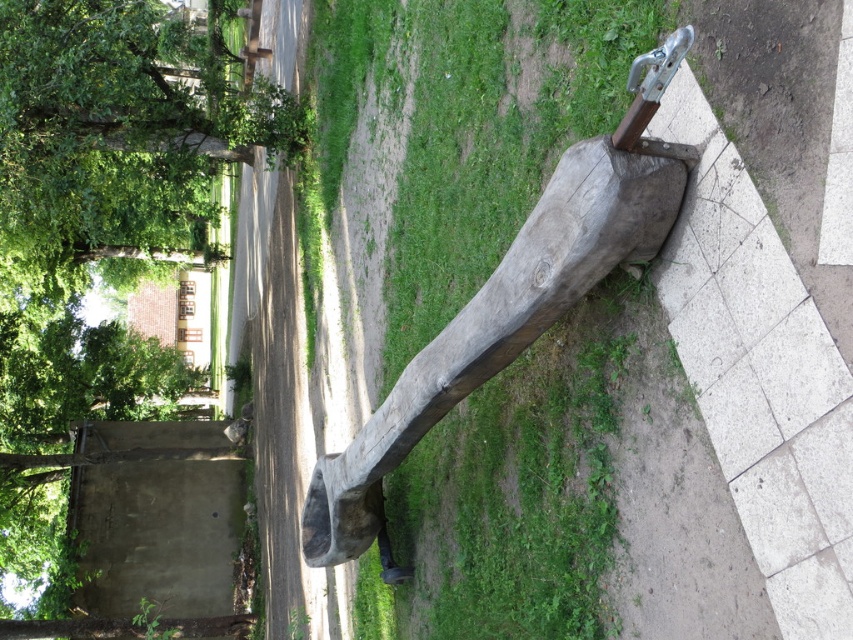
Question: Does green leafy tree at upper left have a larger size compared to wooden log at center?

Choices:
 (A) yes
 (B) no

Answer: (A)

Question: Is green leafy tree at upper left to the right of wooden log at center from the viewer's perspective?

Choices:
 (A) no
 (B) yes

Answer: (A)

Question: Does green leafy tree at upper left appear under wooden log at center?

Choices:
 (A) yes
 (B) no

Answer: (B)